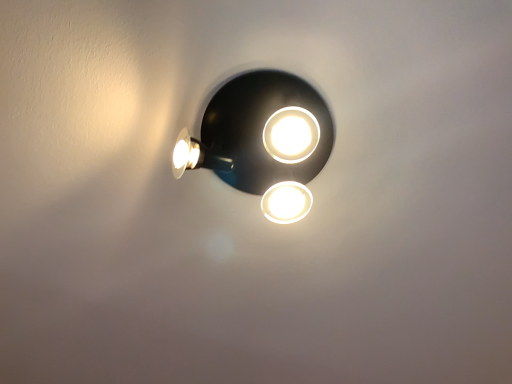
Looking at this image, what is the approximate width of matte black lamp at upper center?

matte black lamp at upper center is 10.99 inches in width.

Describe the element at coordinates (261, 132) in the screenshot. I see `matte black lamp at upper center` at that location.

In order to face matte black lamp at upper center, should I rotate leftwards or rightwards?

Rotate right and turn 1.104 degrees.

Find the location of a particular element. This screenshot has height=384, width=512. matte black lamp at upper center is located at coordinates (261, 132).

Where is `matte black lamp at upper center`? This screenshot has width=512, height=384. matte black lamp at upper center is located at coordinates (261, 132).